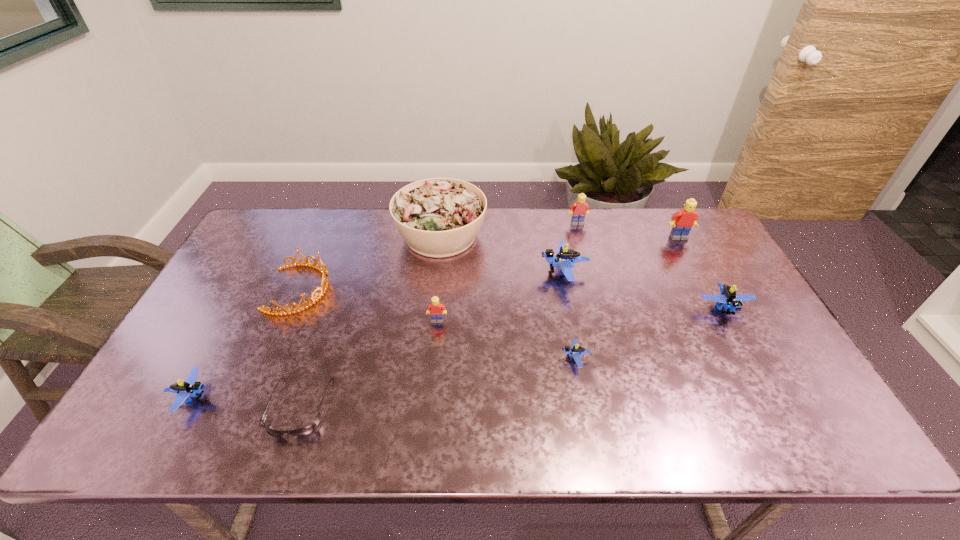
Find the location of `sunglasses that is positioned at the near edge`. sunglasses that is positioned at the near edge is located at coordinates (307, 430).

You are a GUI agent. You are given a task and a screenshot of the screen. Output one action in this format:
    pyautogui.click(x=<x>, y=<y>)
    Task: Click on the tiara situated at the left edge
    The height and width of the screenshot is (540, 960).
    Given the screenshot: What is the action you would take?
    pyautogui.click(x=324, y=285)

Locate an element on the screen. This screenshot has height=540, width=960. Lego present at the left edge is located at coordinates (190, 388).

This screenshot has width=960, height=540. I want to click on object located in the near left corner section of the desktop, so click(x=190, y=388).

You are a GUI agent. You are given a task and a screenshot of the screen. Output one action in this format:
    pyautogui.click(x=<x>, y=<y>)
    Task: Click on the object at the far right corner
    The width and height of the screenshot is (960, 540).
    Given the screenshot: What is the action you would take?
    pyautogui.click(x=682, y=221)

Identify the location of vacant space at the far edge of the desktop. Image resolution: width=960 pixels, height=540 pixels. (617, 251).

The height and width of the screenshot is (540, 960). Identify the location of free space at the near edge. (x=763, y=444).

The image size is (960, 540). In the image, there is a desktop. Find the location of `vacant region at the left edge`. vacant region at the left edge is located at coordinates (149, 410).

In the image, there is a desktop. At what (x,y) coordinates should I click in order to perform the action: click on blank space at the right edge. Please return your answer as a coordinate pair (x, y). Image resolution: width=960 pixels, height=540 pixels. Looking at the image, I should click on (717, 323).

In the image, there is a desktop. At what (x,y) coordinates should I click in order to perform the action: click on vacant space at the far left corner. Please return your answer as a coordinate pair (x, y). The width and height of the screenshot is (960, 540). Looking at the image, I should click on (290, 230).